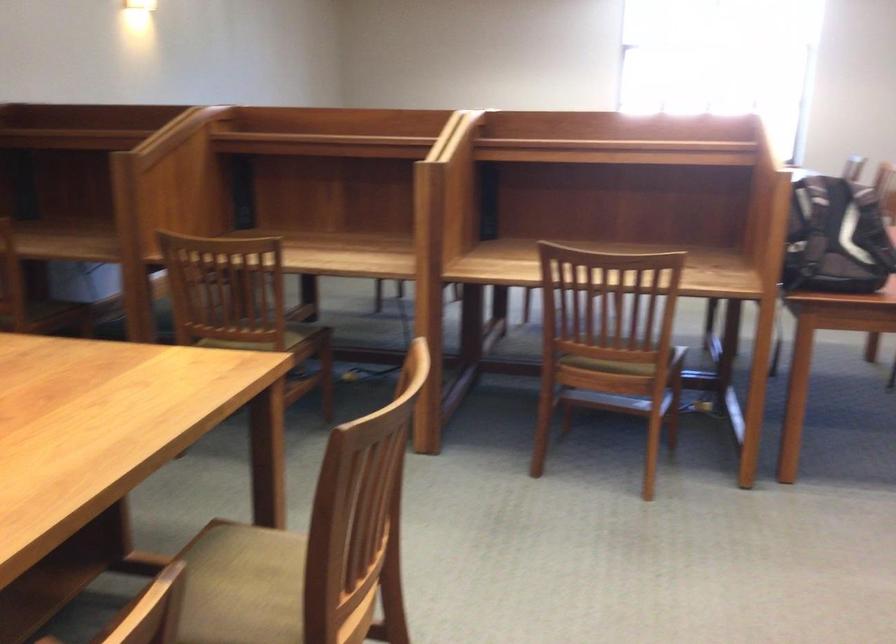
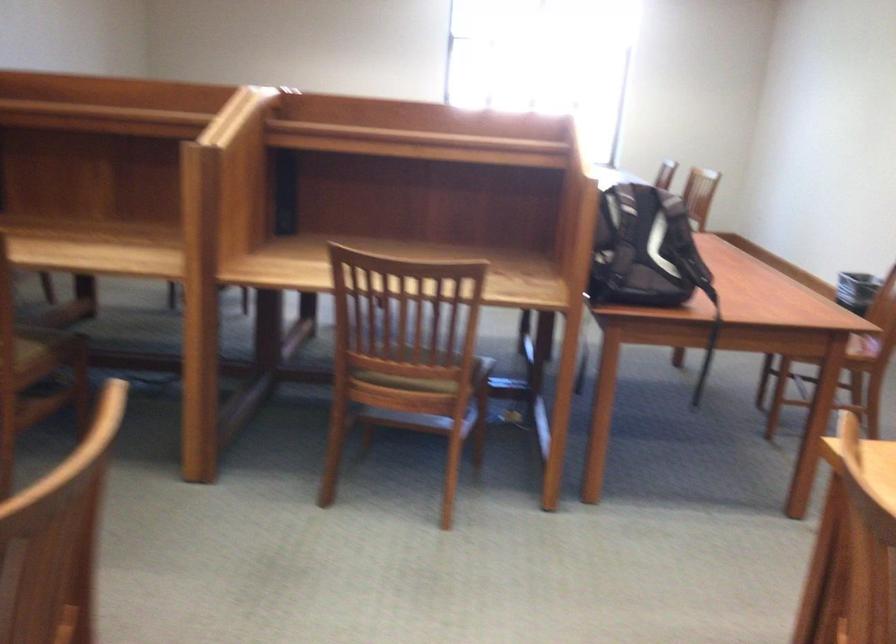
Find the pixel in the second image that matches (629,360) in the first image.

(421, 379)